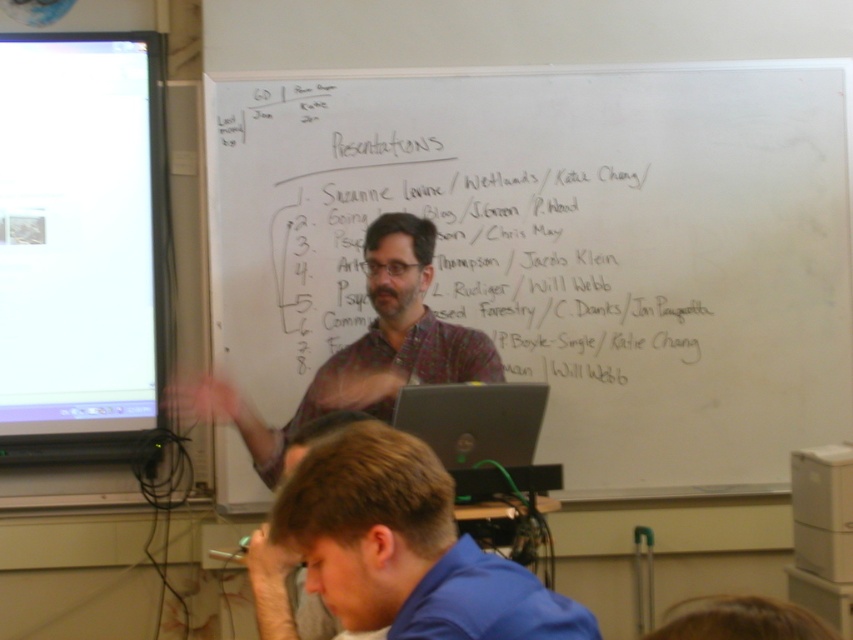
Is whiteboard at center smaller than blue fabric shirt at lower center?

Actually, whiteboard at center might be larger than blue fabric shirt at lower center.

What do you see at coordinates (563, 248) in the screenshot? This screenshot has width=853, height=640. I see `whiteboard at center` at bounding box center [563, 248].

Which is in front, point (548, 456) or point (267, 536)?

Point (267, 536) is in front.

Identify the location of whiteboard at center. (563, 248).

Does point (416, 330) come closer to viewer compared to point (519, 422)?

No, (416, 330) is behind (519, 422).

Is patterned fabric shirt at center taller than silver metallic laptop at center?

Yes, patterned fabric shirt at center is taller than silver metallic laptop at center.

Is point (416, 273) more distant than point (527, 464)?

That is True.

Where is `patterned fabric shirt at center`? This screenshot has height=640, width=853. patterned fabric shirt at center is located at coordinates (364, 349).

Between point (438, 76) and point (10, 77), which one is positioned behind?

The point (438, 76) is behind.

Is whiteboard at center smaller than white glossy projector screen at left?

Actually, whiteboard at center might be larger than white glossy projector screen at left.

You are a GUI agent. You are given a task and a screenshot of the screen. Output one action in this format:
    pyautogui.click(x=<x>, y=<y>)
    Task: Click on the whiteboard at center
    
    Given the screenshot: What is the action you would take?
    pyautogui.click(x=563, y=248)